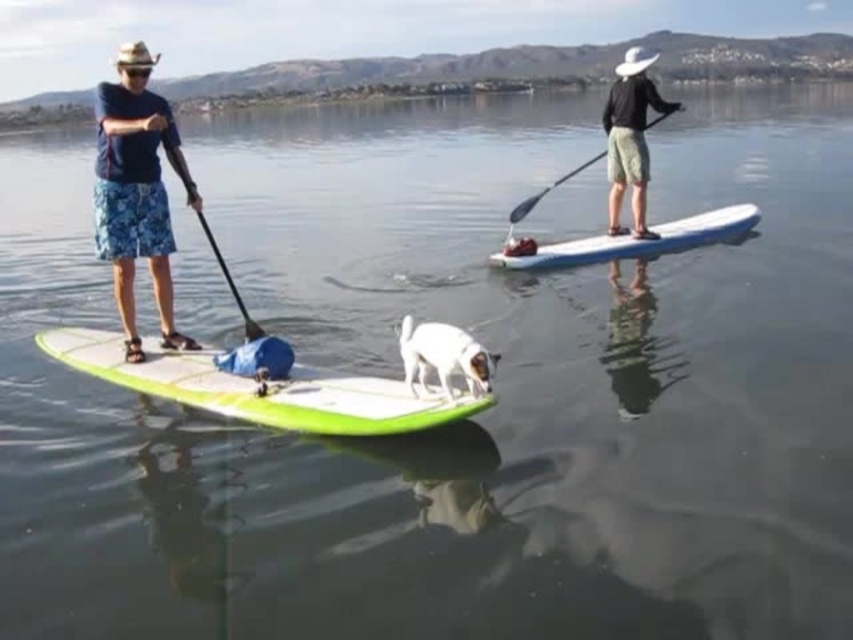
Question: Does white glossy paddleboard at center appear on the left side of black smooth paddle at upper right?

Choices:
 (A) yes
 (B) no

Answer: (A)

Question: Which point is farther to the camera?

Choices:
 (A) blue floral shorts at left
 (B) white glossy paddleboard at center

Answer: (B)

Question: Can you confirm if white glossy paddleboard at center is wider than white smooth dog at center?

Choices:
 (A) yes
 (B) no

Answer: (A)

Question: Is green foam surfboard at center further to camera compared to black smooth paddle at upper right?

Choices:
 (A) yes
 (B) no

Answer: (B)

Question: Which point is closer to the camera taking this photo?

Choices:
 (A) (611, 225)
 (B) (140, 240)
 (C) (347, 380)
 (D) (595, 241)

Answer: (C)

Question: Estimate the real-world distances between objects in this image. Which object is closer to the white glossy paddleboard at center?

Choices:
 (A) black matte paddleboarder at center
 (B) blue floral shorts at left
 (C) black smooth paddle at upper right

Answer: (C)